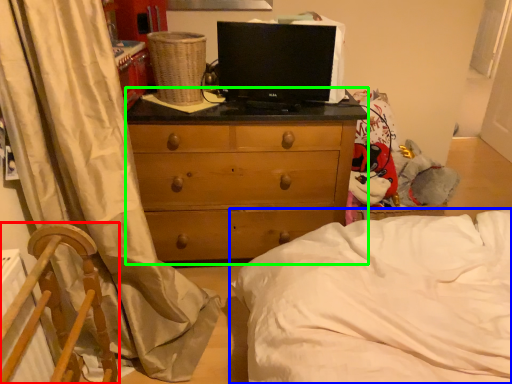
Question: Considering the real-world distances, which object is farthest from furniture (highlighted by a red box)? bed (highlighted by a blue box) or chest of drawers (highlighted by a green box)?

Choices:
 (A) bed
 (B) chest of drawers

Answer: (B)